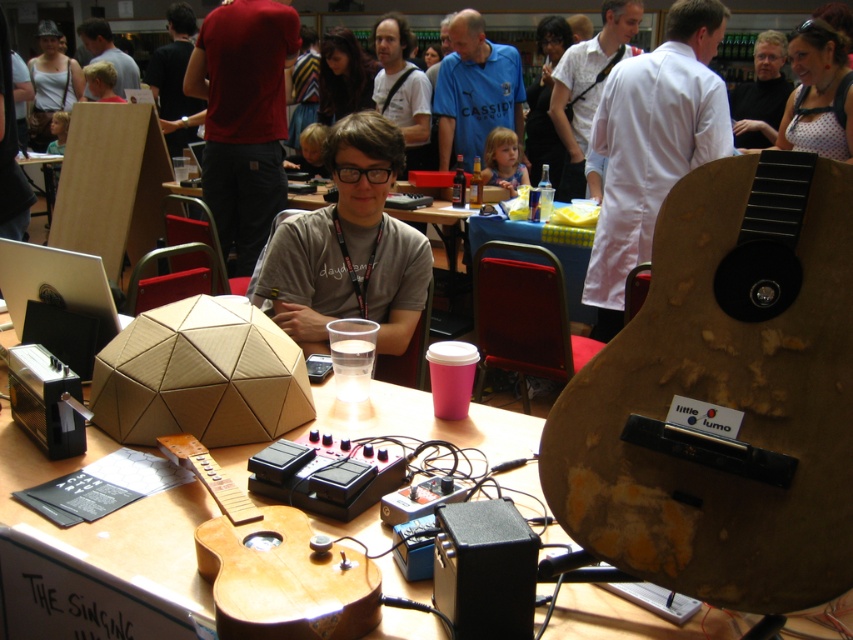
This screenshot has width=853, height=640. What do you see at coordinates (273, 564) in the screenshot?
I see `wooden acoustic guitar at center` at bounding box center [273, 564].

You are a GUI agent. You are given a task and a screenshot of the screen. Output one action in this format:
    pyautogui.click(x=<x>, y=<y>)
    Task: Click on the wooden acoustic guitar at center
    
    Given the screenshot: What is the action you would take?
    pyautogui.click(x=273, y=564)

Does dark red fabric shirt at center have a lesser height compared to matte red shirt at upper center?

Incorrect, dark red fabric shirt at center's height does not fall short of matte red shirt at upper center's.

Does dark red fabric shirt at center appear over matte red shirt at upper center?

Actually, dark red fabric shirt at center is below matte red shirt at upper center.

Which is in front, point (265, 145) or point (171, 52)?

Point (265, 145) is in front.

In order to click on dark red fabric shirt at center in this screenshot , I will do `click(242, 116)`.

Who is taller, matte gray shirt at center or wooden table at center?

Standing taller between the two is matte gray shirt at center.

Measure the distance between point (335,227) and camera.

Point (335,227) and camera are 2.11 meters apart from each other.

Image resolution: width=853 pixels, height=640 pixels. Describe the element at coordinates (349, 246) in the screenshot. I see `matte gray shirt at center` at that location.

Locate an element on the screen. Image resolution: width=853 pixels, height=640 pixels. matte gray shirt at center is located at coordinates tap(349, 246).